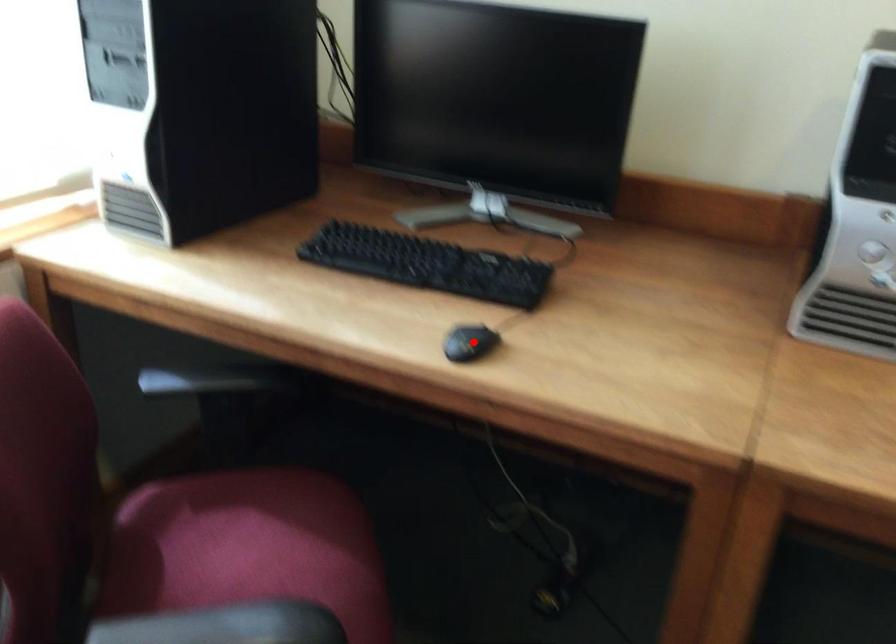
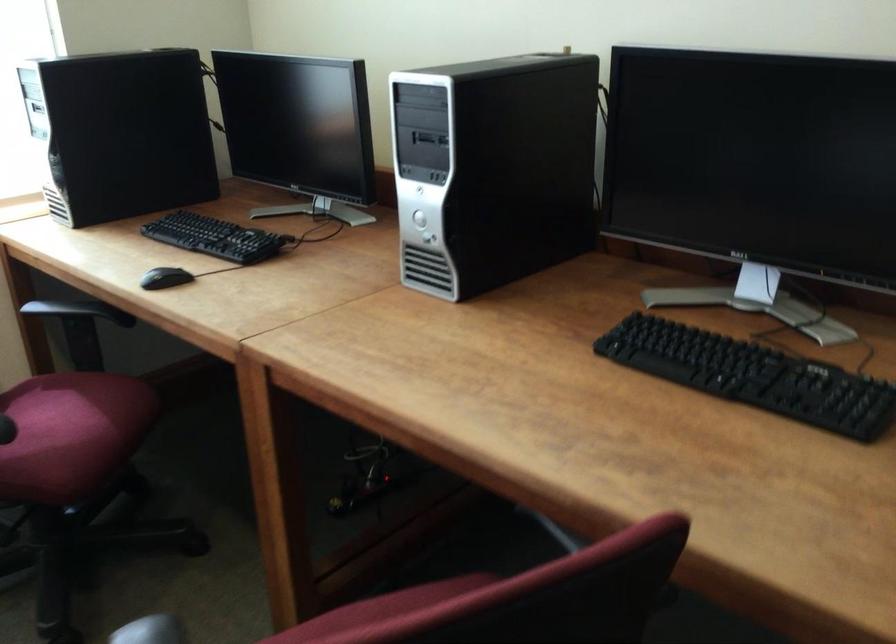
Question: I am providing you with two images of the same scene from different viewpoints. Given a red point in image1, look at the same physical point in image2. Is it:

Choices:
 (A) Closer to the viewpoint
 (B) Farther from the viewpoint

Answer: (B)